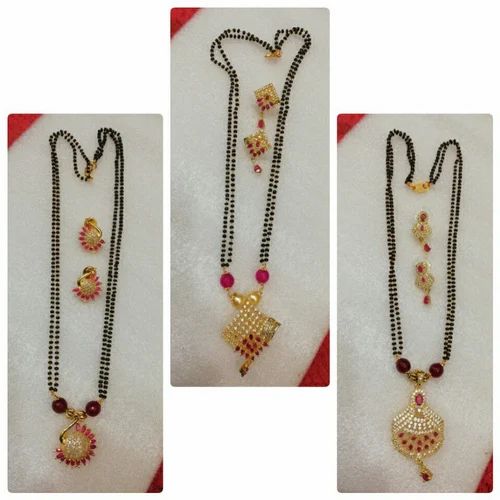
At what (x,y) coordinates should I click in order to perform the action: click on pendant. Please return your answer as a coordinate pair (x, y). This screenshot has width=500, height=500. Looking at the image, I should click on (85, 444).